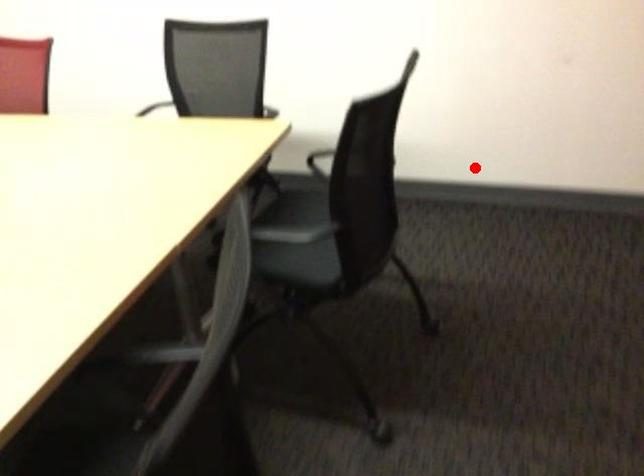
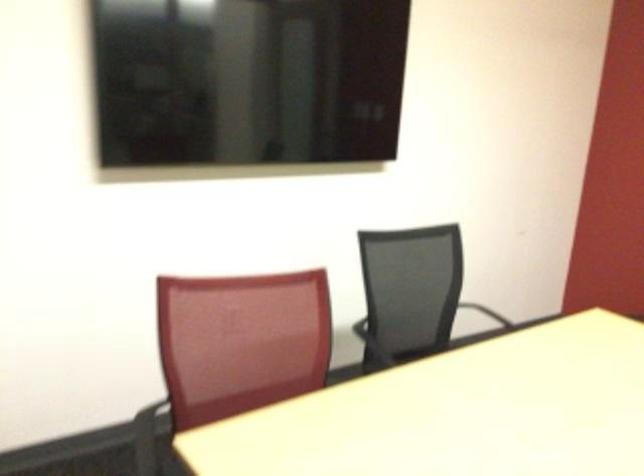
Question: I am providing you with two images of the same scene from different viewpoints. Given a red point in image1, look at the same physical point in image2. Is it:

Choices:
 (A) Closer to the viewpoint
 (B) Farther from the viewpoint

Answer: (B)